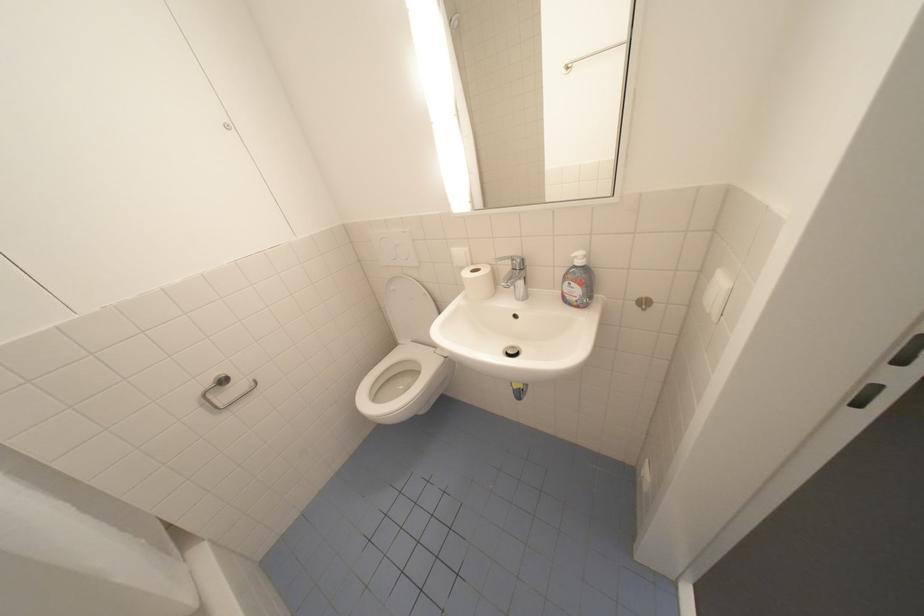
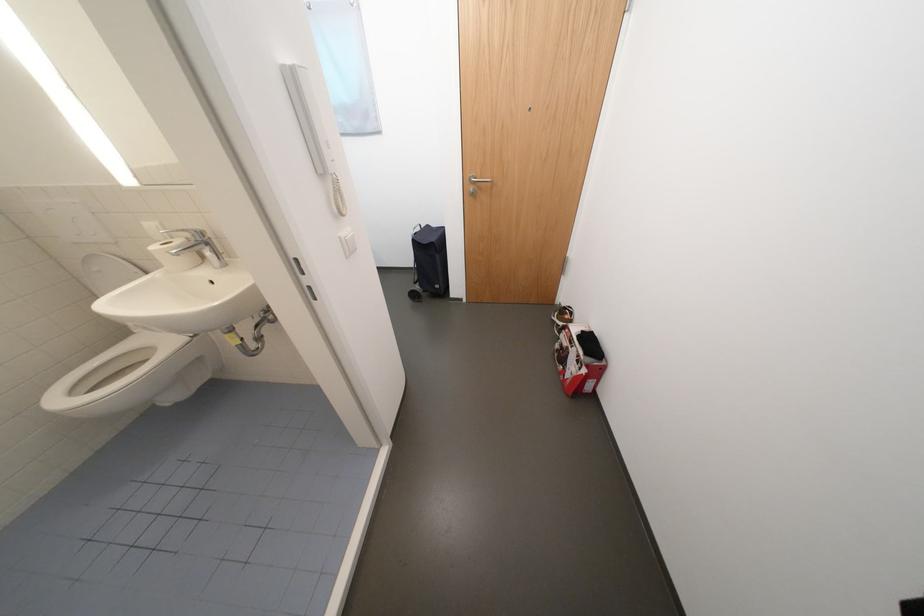
In a continuous first-person perspective shot, in which direction is the camera moving?

The movement direction of the cameraman is right, backward.